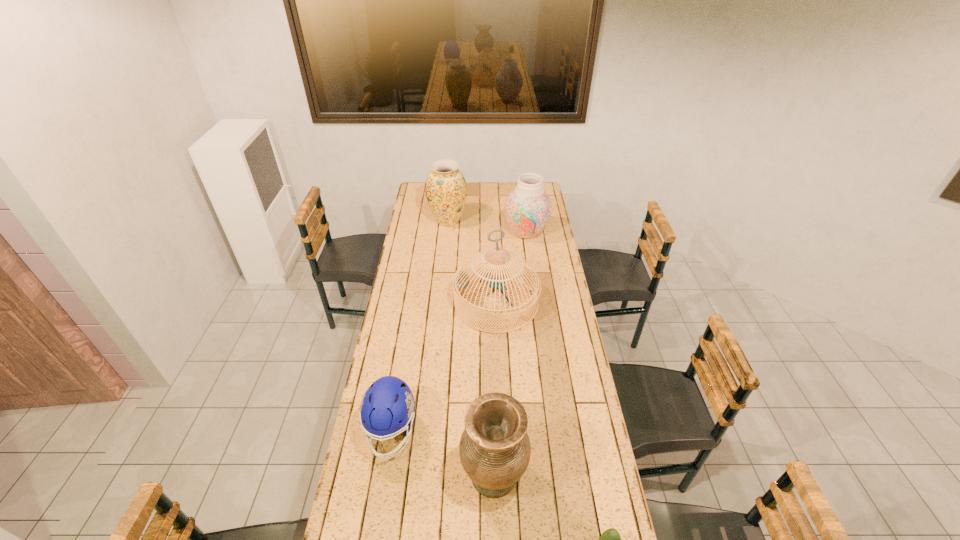
Locate an element on the screen. This screenshot has width=960, height=540. birdcage is located at coordinates (461, 281).

Locate an element on the screen. the leftmost vase is located at coordinates (446, 191).

Find the location of `the nearest vase`. the nearest vase is located at coordinates (494, 448).

The image size is (960, 540). What are the coordinates of `football helmet` in the screenshot? It's located at (388, 406).

Image resolution: width=960 pixels, height=540 pixels. Find the location of `vacant region located 0.200m on the back of the fourth nearest object`. vacant region located 0.200m on the back of the fourth nearest object is located at coordinates (494, 251).

Where is `blank area located on the back of the leftmost vase`? The image size is (960, 540). blank area located on the back of the leftmost vase is located at coordinates (451, 186).

At what (x,y) coordinates should I click in order to perform the action: click on free spot located 0.140m on the right of the nearest vase. Please return your answer as a coordinate pair (x, y). Looking at the image, I should click on (570, 475).

The height and width of the screenshot is (540, 960). I want to click on free space located 0.200m on the face guard of the football helmet, so click(x=374, y=532).

I want to click on vase at the left edge, so click(446, 191).

The image size is (960, 540). What are the coordinates of `football helmet positioned at the left edge` in the screenshot? It's located at (388, 406).